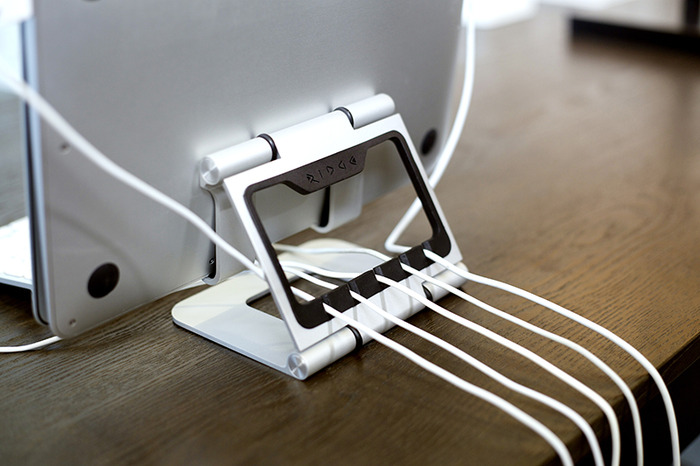
This screenshot has width=700, height=466. I want to click on wires in holder, so click(x=360, y=328), click(x=382, y=314), click(x=407, y=293), click(x=423, y=274), click(x=449, y=264).